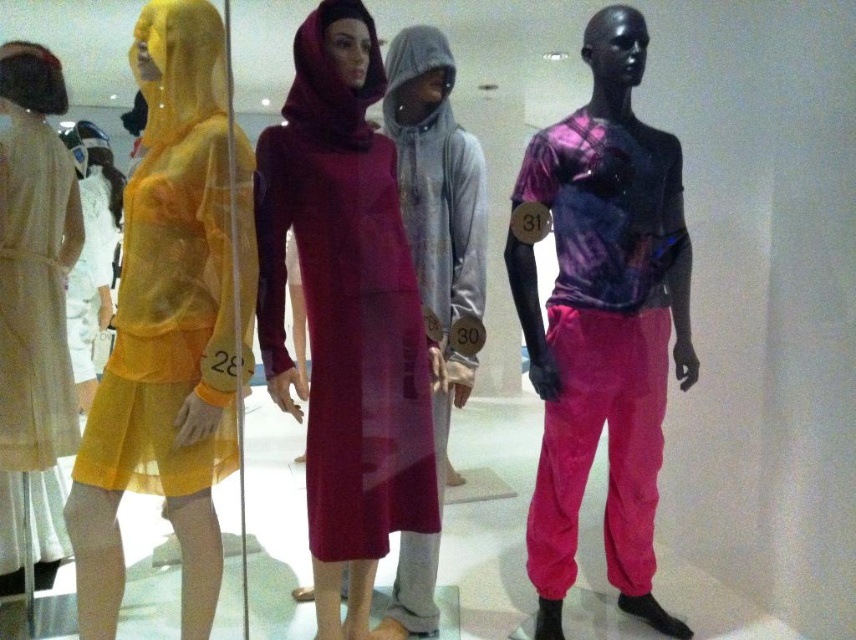
Does velvet burgundy dress at center come in front of gray fleece hoodie at center?

Yes.

Based on the photo, between velvet burgundy dress at center and gray fleece hoodie at center, which one has more height?

With more height is gray fleece hoodie at center.

Does point (318, 470) lie behind point (423, 605)?

No, (318, 470) is in front of (423, 605).

The image size is (856, 640). I want to click on velvet burgundy dress at center, so click(x=346, y=312).

Is translucent yellow dress at left closer to camera compared to light beige pleated dress at left?

Yes, translucent yellow dress at left is in front of light beige pleated dress at left.

Between translucent yellow dress at left and light beige pleated dress at left, which one has more height?

translucent yellow dress at left is taller.

The width and height of the screenshot is (856, 640). What do you see at coordinates (171, 323) in the screenshot?
I see `translucent yellow dress at left` at bounding box center [171, 323].

Where is `translucent yellow dress at left`? translucent yellow dress at left is located at coordinates (171, 323).

Does shiny purple fabric shirt at center appear under gray fleece hoodie at center?

Yes, shiny purple fabric shirt at center is below gray fleece hoodie at center.

Does shiny purple fabric shirt at center lie in front of gray fleece hoodie at center?

No, shiny purple fabric shirt at center is further to the viewer.

At what (x,y) coordinates should I click in order to perform the action: click on shiny purple fabric shirt at center. Please return your answer as a coordinate pair (x, y). The image size is (856, 640). Looking at the image, I should click on (599, 333).

The height and width of the screenshot is (640, 856). I want to click on shiny purple fabric shirt at center, so click(599, 333).